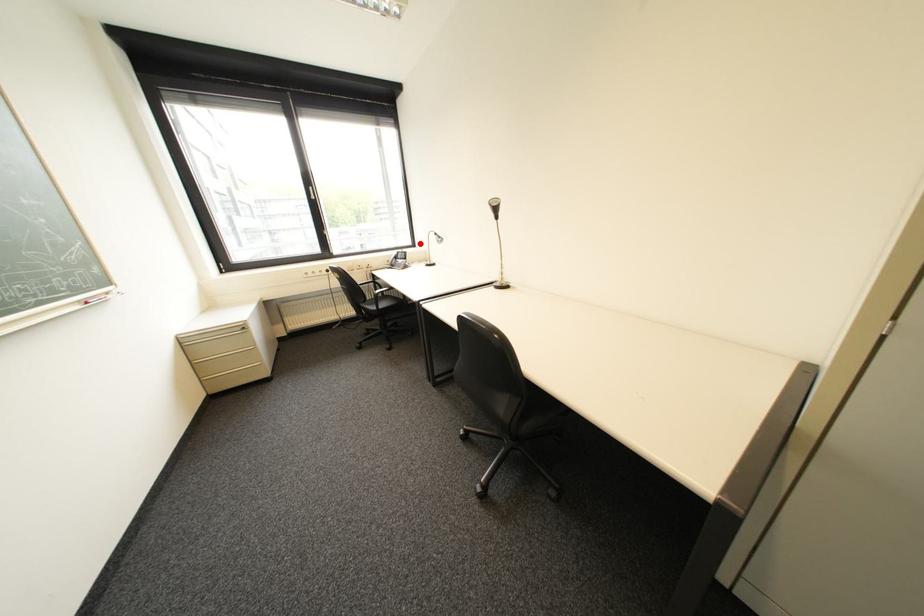
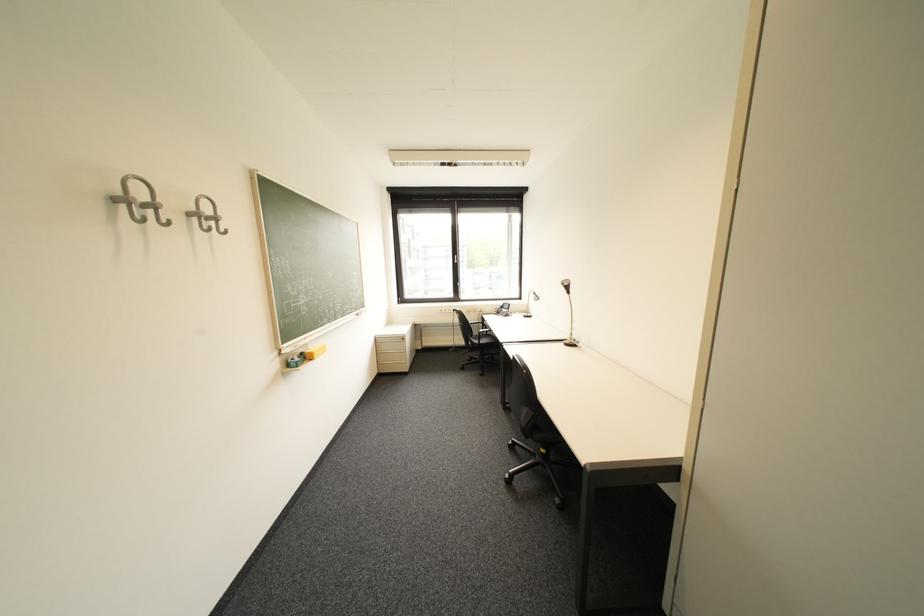
Where in the second image is the point corresponding to the highlighted location from the first image?

(528, 297)